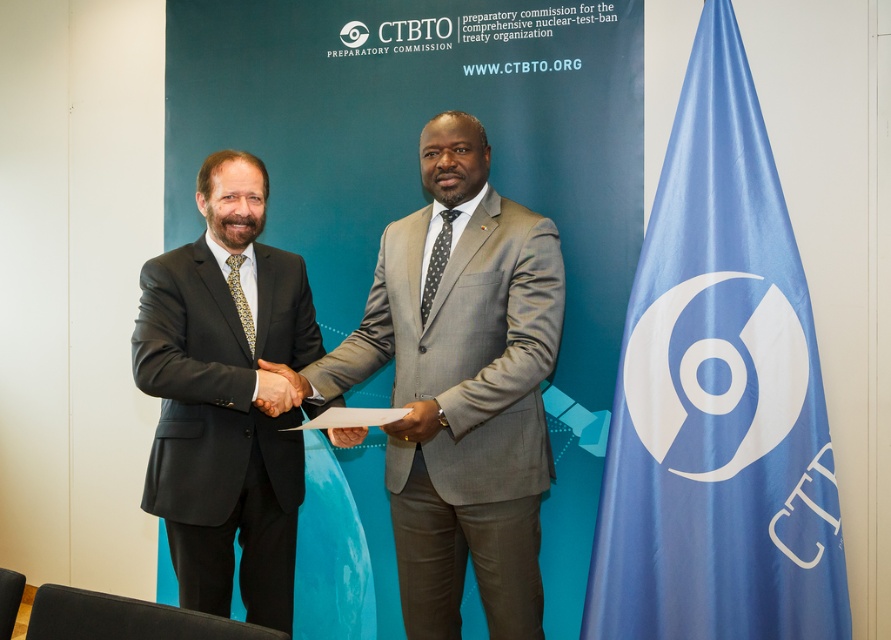
You are attending a formal event and notice the blue fabric flag at right and the gray wool suit at center. Which object takes up more visual space in the image?

The gray wool suit at center occupies more visual space than the blue fabric flag at right.

Based on the scene description, if you were standing at the position of the man on the right, would the point labeled as point (730, 170) be located behind the point labeled point (424, 557) from your perspective?

Yes, because according to the objects description, point (730, 170) is behind point (424, 557).

You are a photographer standing in front of the CTBTO PREPARATORY COMMISSION backdrop. You need to focus your camera on the black leather hand at center. What are the coordinates where you should aim your camera?

The coordinates for the black leather hand at center are at point (x=278, y=388).